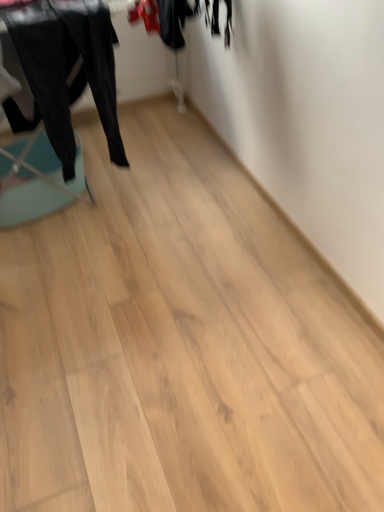
What do you see at coordinates (68, 68) in the screenshot? The height and width of the screenshot is (512, 384). I see `black matte pants at left` at bounding box center [68, 68].

What is the approximate height of black matte pants at left?

26.07 inches.

Where is `black matte pants at left`? The image size is (384, 512). black matte pants at left is located at coordinates (68, 68).

At what (x,y) coordinates should I click in order to perform the action: click on black matte pants at left. Please return your answer as a coordinate pair (x, y). The height and width of the screenshot is (512, 384). Looking at the image, I should click on (68, 68).